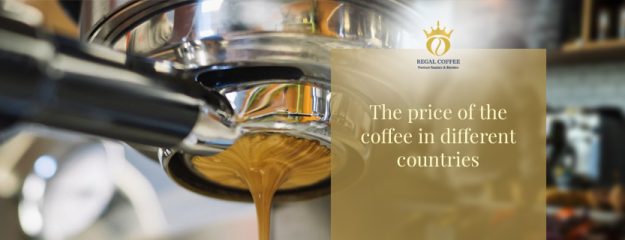
I want to click on backsplash wall, so click(607, 85).